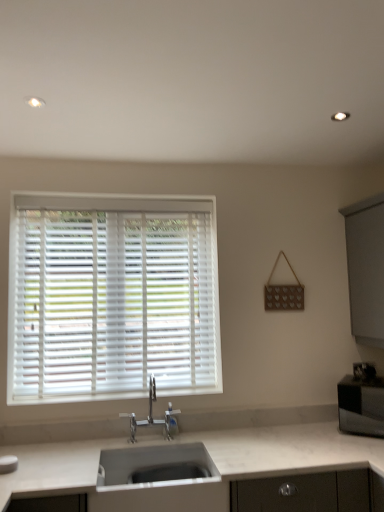
Question: Is white matte sink at center shorter than white marble countertop at lower center?

Choices:
 (A) yes
 (B) no

Answer: (A)

Question: Is white matte sink at center next to white marble countertop at lower center?

Choices:
 (A) no
 (B) yes

Answer: (A)

Question: Does white matte sink at center have a greater width compared to white marble countertop at lower center?

Choices:
 (A) yes
 (B) no

Answer: (B)

Question: Is white matte sink at center positioned far away from white marble countertop at lower center?

Choices:
 (A) yes
 (B) no

Answer: (B)

Question: Can you confirm if white matte sink at center is taller than white marble countertop at lower center?

Choices:
 (A) no
 (B) yes

Answer: (A)

Question: Is white matte sink at center positioned behind white marble countertop at lower center?

Choices:
 (A) no
 (B) yes

Answer: (B)

Question: Can you confirm if polished chrome faucet at center is bigger than white plastic blinds at upper left?

Choices:
 (A) yes
 (B) no

Answer: (B)

Question: Is polished chrome faucet at center touching white plastic blinds at upper left?

Choices:
 (A) no
 (B) yes

Answer: (A)

Question: From the image's perspective, is polished chrome faucet at center over white plastic blinds at upper left?

Choices:
 (A) yes
 (B) no

Answer: (B)

Question: Considering the relative positions of polished chrome faucet at center and white plastic blinds at upper left in the image provided, is polished chrome faucet at center behind white plastic blinds at upper left?

Choices:
 (A) yes
 (B) no

Answer: (B)

Question: Is polished chrome faucet at center wider than white plastic blinds at upper left?

Choices:
 (A) no
 (B) yes

Answer: (B)

Question: Is polished chrome faucet at center positioned before white plastic blinds at upper left?

Choices:
 (A) yes
 (B) no

Answer: (A)

Question: Is the depth of satin black microwave at right greater than that of white marble countertop at lower center?

Choices:
 (A) yes
 (B) no

Answer: (A)